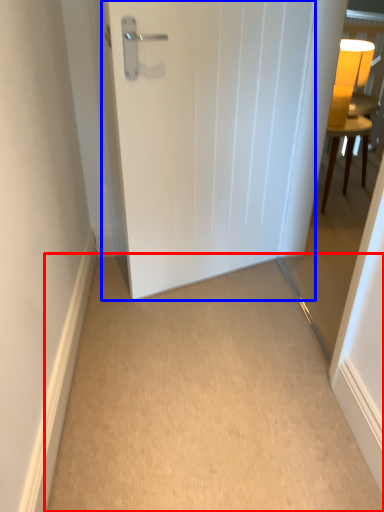
Question: Which object appears farthest to the camera in this image, corridor (highlighted by a red box) or door (highlighted by a blue box)?

Choices:
 (A) corridor
 (B) door

Answer: (B)